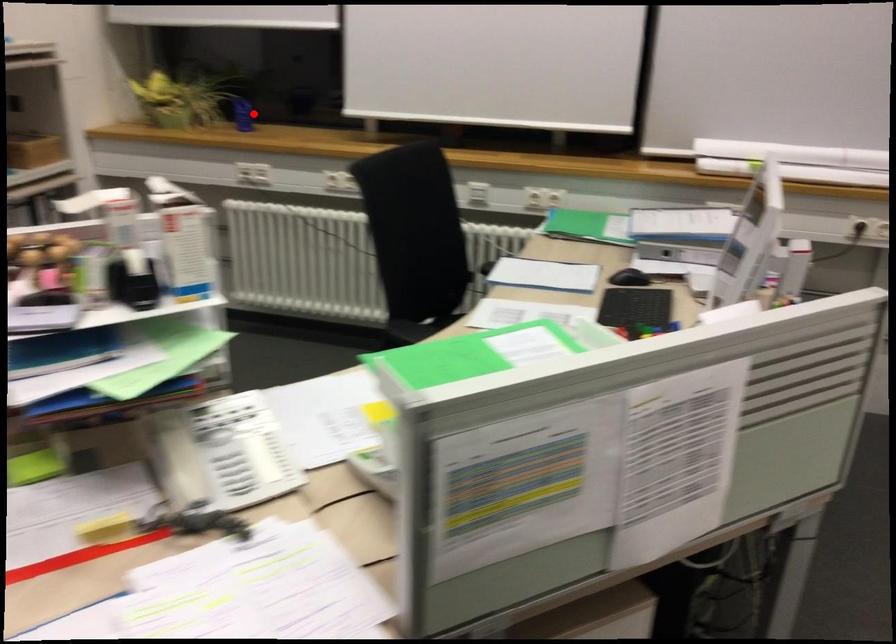
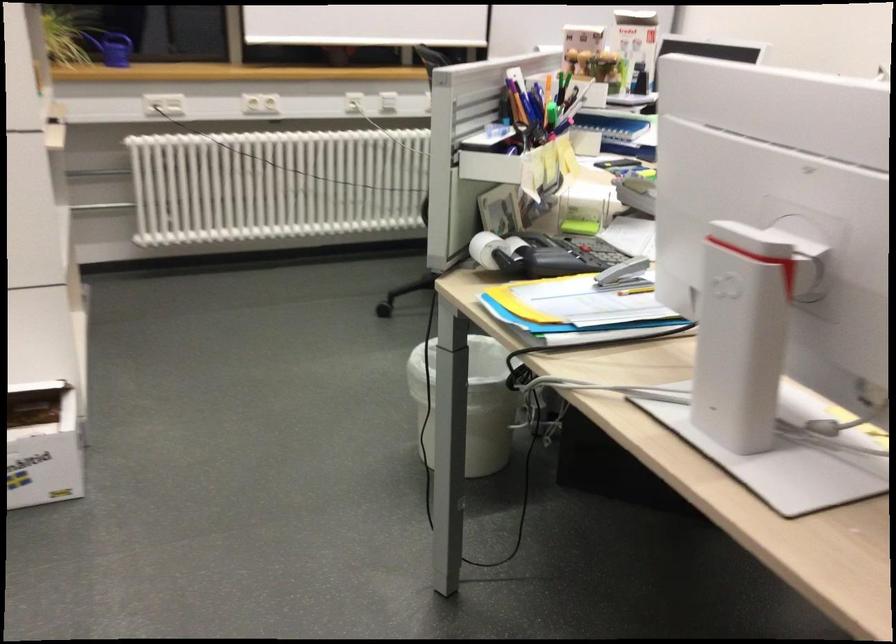
The point at the highlighted location is marked in the first image. Where is the corresponding point in the second image?

(112, 48)